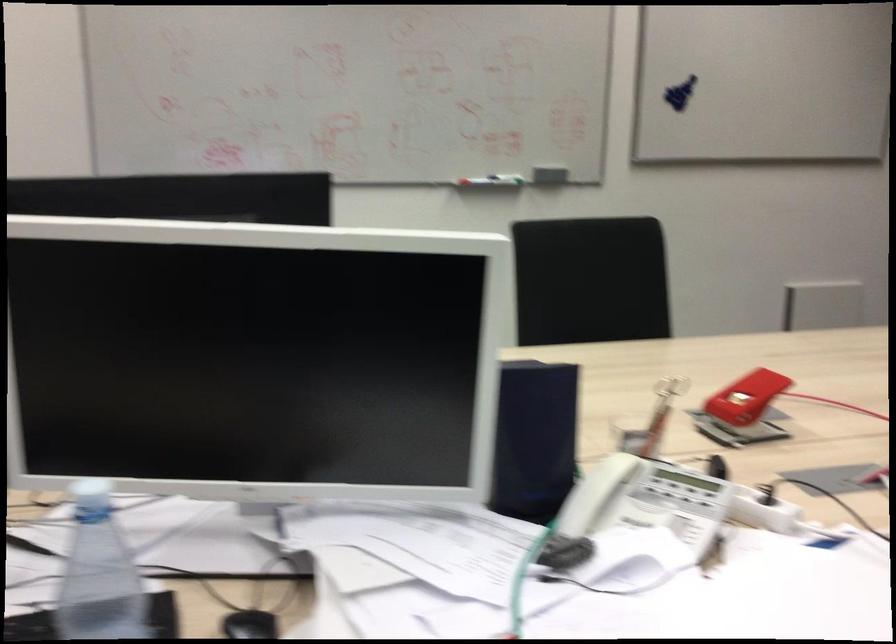
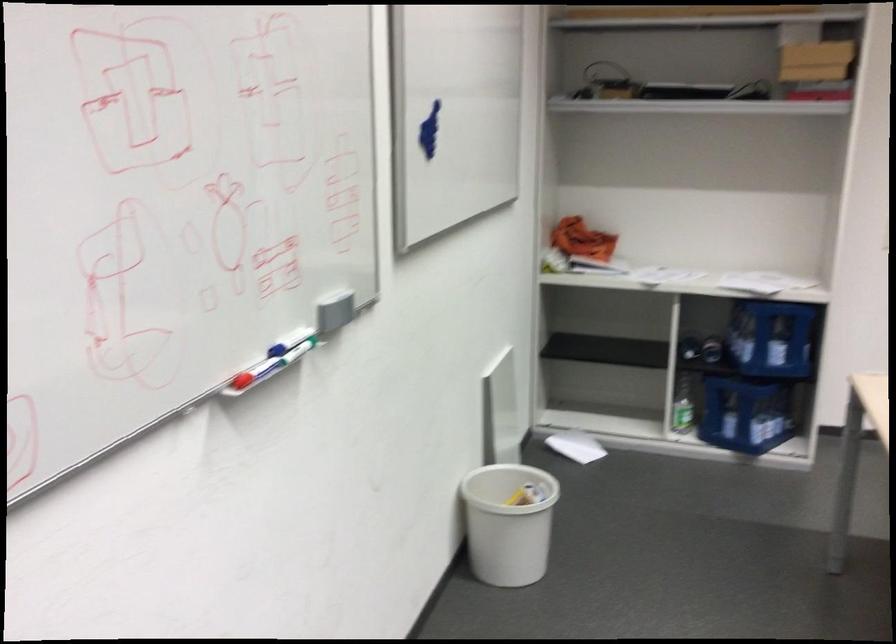
The point at (576, 164) is marked in the first image. Where is the corresponding point in the second image?

(334, 310)